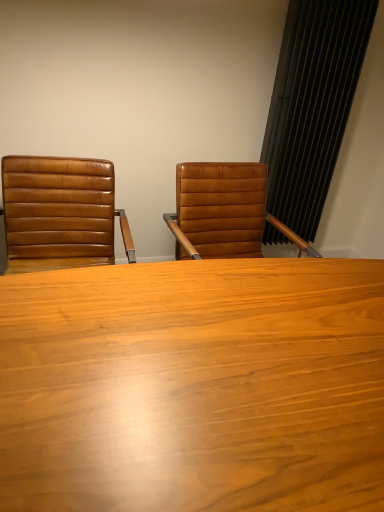
Identify the location of vacant area on top of wooden table at center (from a real-world perspective). (159, 372).